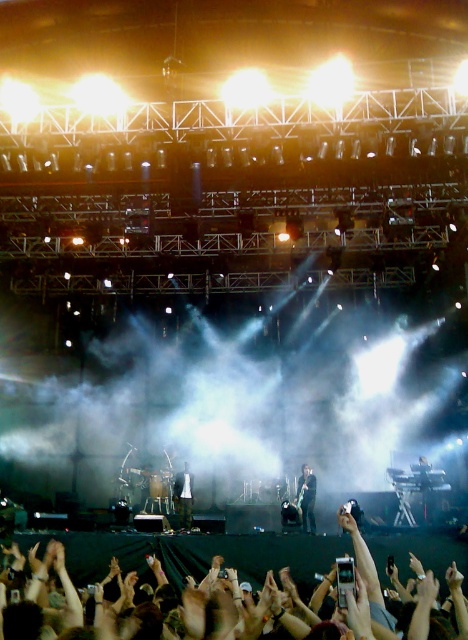
Does shiny black jacket at center come in front of matte black guitar at center?

Yes.

Does shiny black jacket at center have a greater height compared to matte black guitar at center?

Yes, shiny black jacket at center is taller than matte black guitar at center.

Which is in front, point (312, 484) or point (181, 480)?

Point (312, 484)

Where is `shiny black jacket at center`? The image size is (468, 640). shiny black jacket at center is located at coordinates (307, 497).